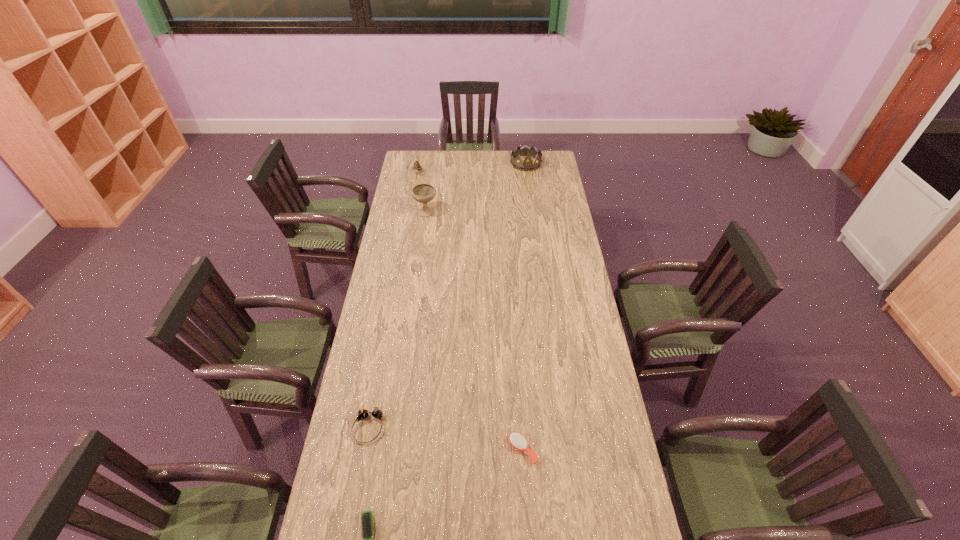
At what (x,y) coordinates should I click in order to perform the action: click on tiara. Please return your answer as a coordinate pair (x, y). Looking at the image, I should click on (527, 165).

This screenshot has height=540, width=960. Identify the location of the third farthest object. (423, 193).

Find the location of a particular element. This screenshot has width=960, height=540. snail is located at coordinates (417, 167).

The width and height of the screenshot is (960, 540). I want to click on goggles, so (363, 413).

Locate an element on the screen. The width and height of the screenshot is (960, 540). the right hairbrush is located at coordinates (517, 440).

Where is `vacant area situated at the front of the tiara with jewels`? Image resolution: width=960 pixels, height=540 pixels. vacant area situated at the front of the tiara with jewels is located at coordinates (529, 189).

Where is `free space located 0.190m on the right of the chalice`? The image size is (960, 540). free space located 0.190m on the right of the chalice is located at coordinates (473, 211).

Find the location of a particular element. vacant space situated 0.220m on the face of the third tallest object is located at coordinates (413, 201).

You are a GUI agent. You are given a task and a screenshot of the screen. Output one action in this format:
    pyautogui.click(x=<x>, y=<y>)
    Task: Click on the free spot located 0.070m through the lenses of the goggles
    
    Given the screenshot: What is the action you would take?
    pyautogui.click(x=361, y=466)

Identify the location of free spot located on the back of the right hairbrush. (516, 343).